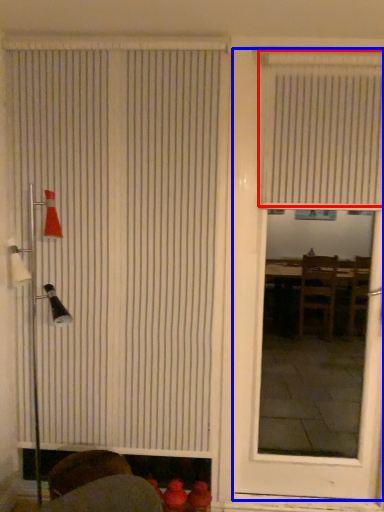
Question: Which of the following is the farthest to the observer, window blind (highlighted by a red box) or door (highlighted by a blue box)?

Choices:
 (A) window blind
 (B) door

Answer: (A)